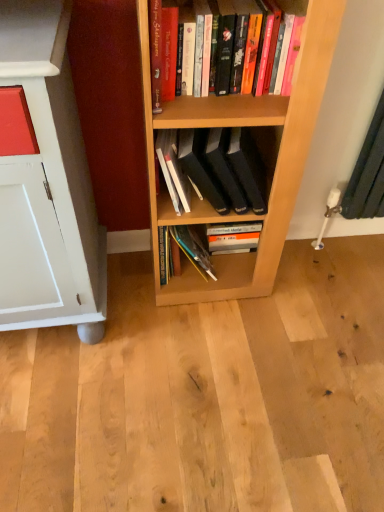
Question: Considering the positions of point (258, 152) and point (281, 1), is point (258, 152) closer or farther from the camera than point (281, 1)?

Choices:
 (A) closer
 (B) farther

Answer: (B)

Question: Is black matte book at center, the 1th book when ordered from bottom to top, taller or shorter than hardcover books at upper center, the second book from the bottom?

Choices:
 (A) tall
 (B) short

Answer: (A)

Question: From a real-world perspective, is black matte book at center, the 1th book when ordered from bottom to top, physically located above or below hardcover books at upper center, the second book from the bottom?

Choices:
 (A) above
 (B) below

Answer: (B)

Question: In the image, is hardcover books at upper center, the first book when ordered from top to bottom, on the left side or the right side of black matte book at center, the 1th book when ordered from bottom to top?

Choices:
 (A) left
 (B) right

Answer: (B)

Question: From the image's perspective, is hardcover books at upper center, the first book when ordered from top to bottom, positioned above or below black matte book at center, acting as the 2th book starting from the top?

Choices:
 (A) below
 (B) above

Answer: (B)

Question: From a real-world perspective, is hardcover books at upper center, the second book from the bottom, above or below black matte book at center, the 1th book when ordered from bottom to top?

Choices:
 (A) below
 (B) above

Answer: (B)

Question: Does point (220, 5) appear closer or farther from the camera than point (206, 146)?

Choices:
 (A) farther
 (B) closer

Answer: (B)